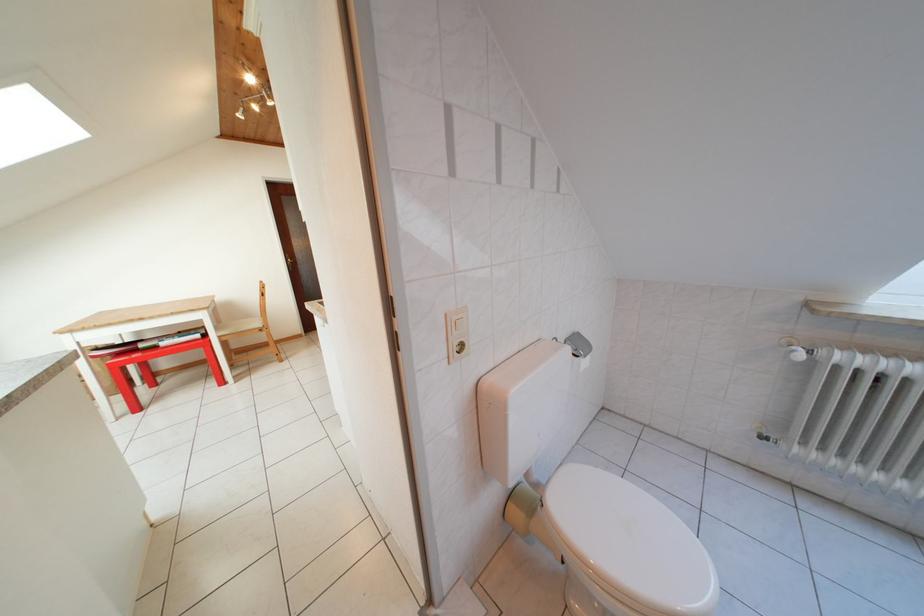
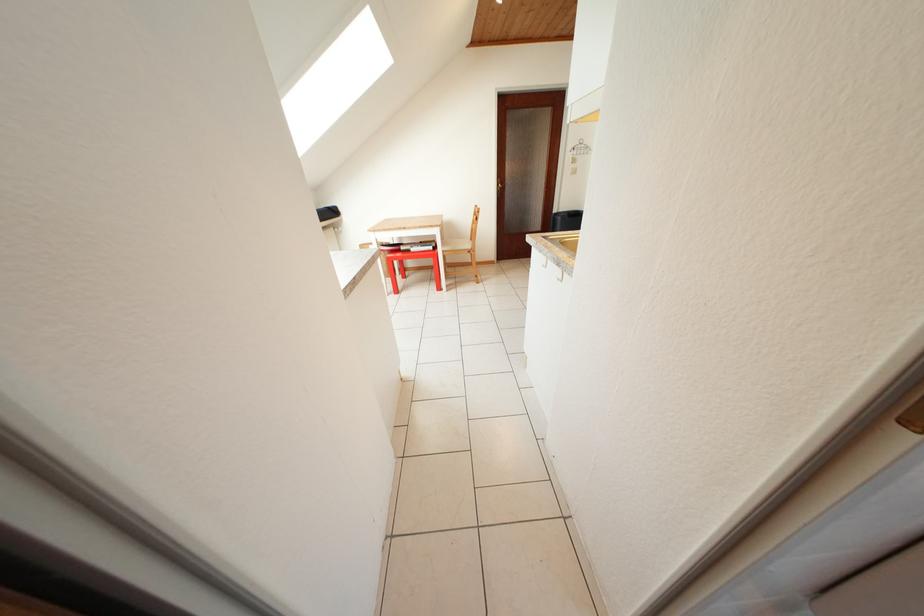
Locate, in the second image, the point that corresponds to point 232,338 in the first image.

(454, 254)